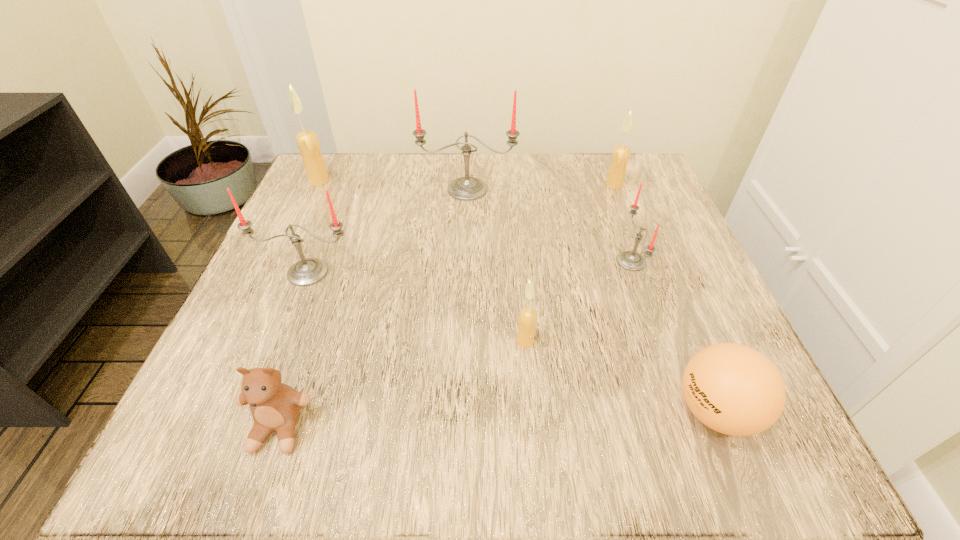
Where is `free point located on the side with brand of the ping-pong ball`? free point located on the side with brand of the ping-pong ball is located at coordinates (519, 411).

I want to click on ping-pong ball that is at the near edge, so click(x=731, y=388).

You are a GUI agent. You are given a task and a screenshot of the screen. Output one action in this format:
    pyautogui.click(x=<x>, y=<y>)
    Task: Click on the teddy bear positioned at the near edge
    The height and width of the screenshot is (540, 960).
    Given the screenshot: What is the action you would take?
    pyautogui.click(x=275, y=406)

Identify the location of teddy bear that is at the left edge. (275, 406).

The height and width of the screenshot is (540, 960). Identify the location of ping-pong ball at the right edge. (731, 388).

This screenshot has width=960, height=540. Find the location of `object that is at the far left corner`. object that is at the far left corner is located at coordinates pyautogui.click(x=307, y=141).

The height and width of the screenshot is (540, 960). Find the location of `object positioned at the near left corner`. object positioned at the near left corner is located at coordinates (275, 406).

Locate an element on the screen. The width and height of the screenshot is (960, 540). object located in the far right corner section of the desktop is located at coordinates (621, 153).

Where is `object positioned at the near right corner`? The width and height of the screenshot is (960, 540). object positioned at the near right corner is located at coordinates (731, 388).

Find the location of a particular element. Image resolution: width=960 pixels, height=540 pixels. vacant space at the far edge of the desktop is located at coordinates (416, 184).